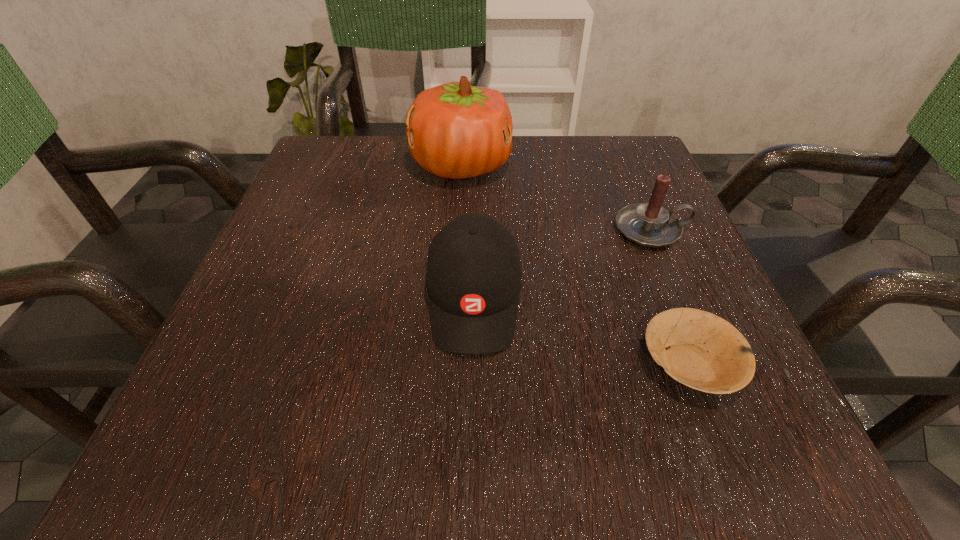
Locate which object ranks in proximity to the bowl. Please provide its 2D coordinates. Your answer should be formatted as a tuple, i.e. [(x, y)], where the tuple contains the x and y coordinates of a point satisfying the conditions above.

[(473, 277)]

In order to click on object that stands as the second closest to the candle in this screenshot , I will do 473,277.

Identify the location of vacant space that satisfies the following two spatial constraints: 1. on the side of the candle with the handle loop; 2. with a logo on the front of the baseball cap. The image size is (960, 540). (679, 298).

Where is `blank space that satisfies the following two spatial constraints: 1. on the side of the candle with the handle loop; 2. on the front side of the bowl`? blank space that satisfies the following two spatial constraints: 1. on the side of the candle with the handle loop; 2. on the front side of the bowl is located at coordinates (707, 364).

The image size is (960, 540). In order to click on free space in the image that satisfies the following two spatial constraints: 1. on the side of the bowl with the cute face; 2. on the right side of the farthest object in this screenshot , I will do `click(450, 364)`.

The height and width of the screenshot is (540, 960). Identify the location of free point that satisfies the following two spatial constraints: 1. on the side of the shortest object with the cute face; 2. on the right side of the tallest object. (450, 364).

Where is `vacant space that satisfies the following two spatial constraints: 1. with a logo on the front of the baseball cap; 2. on the right side of the shortest object`? vacant space that satisfies the following two spatial constraints: 1. with a logo on the front of the baseball cap; 2. on the right side of the shortest object is located at coordinates (473, 364).

You are a GUI agent. You are given a task and a screenshot of the screen. Output one action in this format:
    pyautogui.click(x=<x>, y=<y>)
    Task: Click on the free space that satisfies the following two spatial constraints: 1. on the side of the bowl with the cute face; 2. on the left side of the pumpkin
    The height and width of the screenshot is (540, 960).
    Given the screenshot: What is the action you would take?
    pyautogui.click(x=450, y=364)